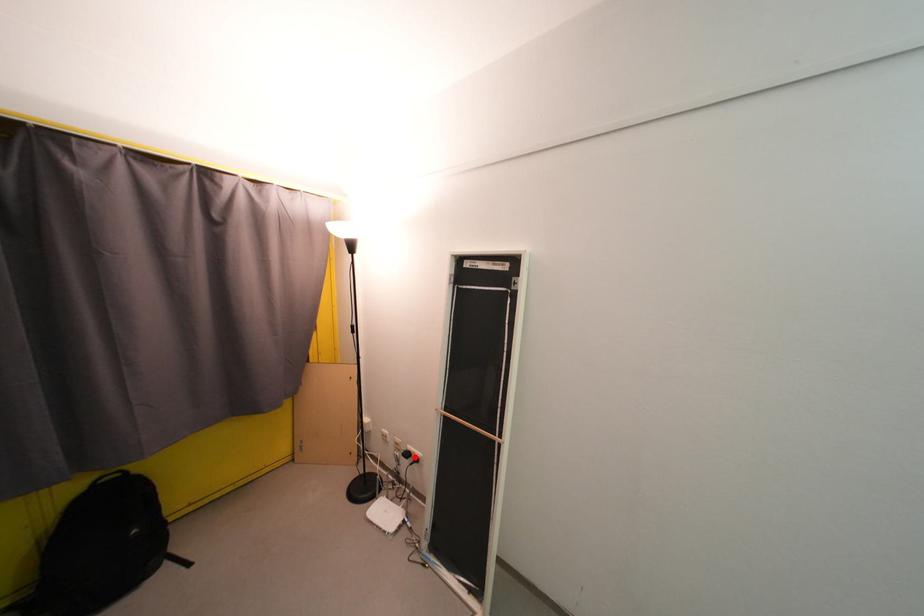
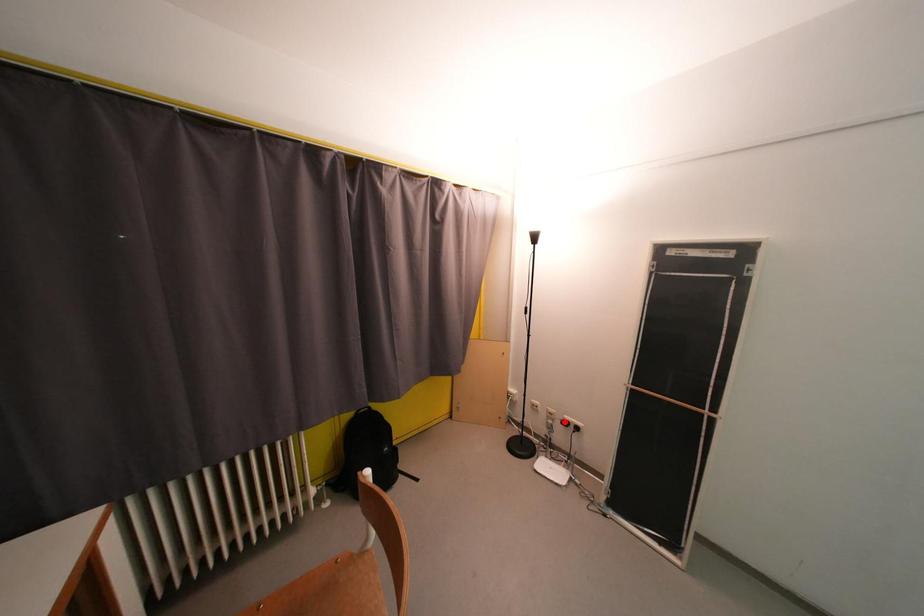
I am providing you with two images of the same scene from different viewpoints. A red point is marked on the first image and another point is marked on the second image. Do the highlighted points in image1 and image2 indicate the same real-world spot?

No